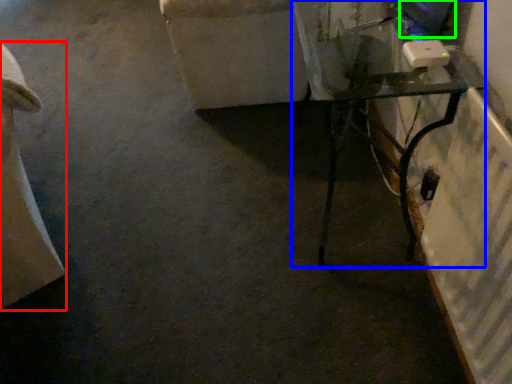
Question: Estimate the real-world distances between objects in this image. Which object is closer to furniture (highlighted by a red box), table (highlighted by a blue box) or computer screen (highlighted by a green box)?

Choices:
 (A) table
 (B) computer screen

Answer: (A)